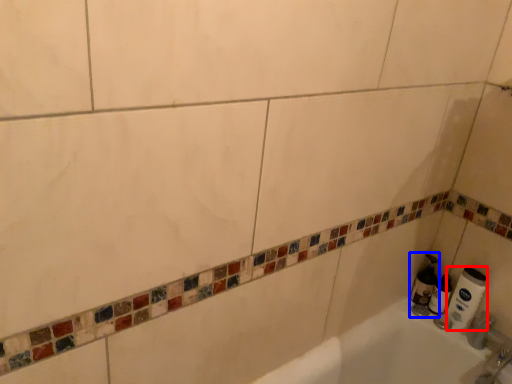
Question: Among these objects, which one is nearest to the camera, toilet paper (highlighted by a red box) or soap dispenser (highlighted by a blue box)?

Choices:
 (A) toilet paper
 (B) soap dispenser

Answer: (A)